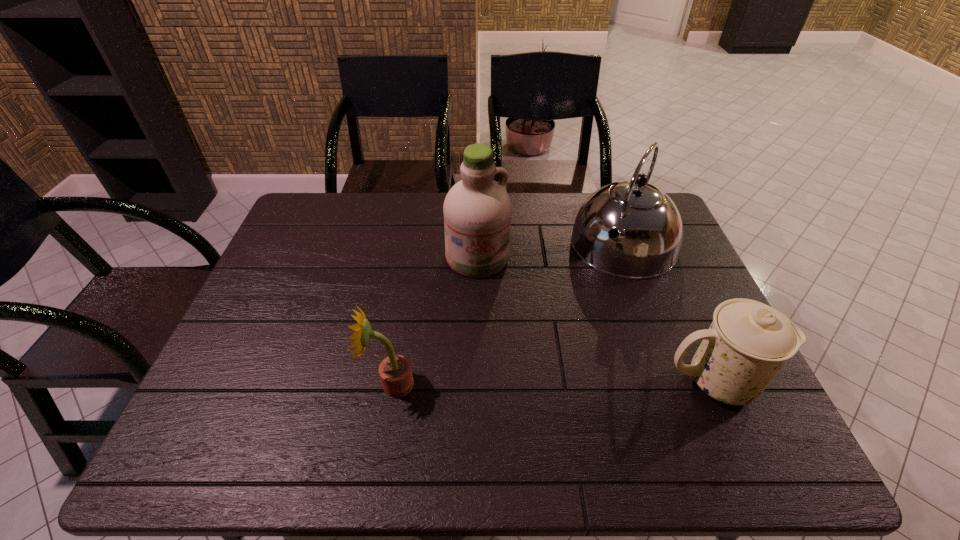
Find the location of a particular element. free location located 0.190m from the spout of the kettle is located at coordinates (579, 316).

You are a GUI agent. You are given a task and a screenshot of the screen. Output one action in this format:
    pyautogui.click(x=<x>, y=<y>)
    Task: Click on the vacant area located from the spout of the kettle
    This screenshot has width=960, height=540.
    Given the screenshot: What is the action you would take?
    pyautogui.click(x=568, y=334)

Locate an element on the screen. The image size is (960, 540). vacant area situated from the spout of the kettle is located at coordinates (574, 324).

This screenshot has width=960, height=540. Identify the location of object present at the far edge. (650, 227).

Find the location of a particular element. sunflower at the near edge is located at coordinates coord(395,371).

Find the location of `chinaware present at the near edge`. chinaware present at the near edge is located at coordinates (748, 342).

I want to click on chinaware at the right edge, so click(x=748, y=342).

At what (x,y) coordinates should I click in order to perform the action: click on kettle present at the right edge. Please return your answer as a coordinate pair (x, y). The width and height of the screenshot is (960, 540). Looking at the image, I should click on (650, 227).

Find the location of a particular element. The height and width of the screenshot is (540, 960). object that is at the far right corner is located at coordinates pyautogui.click(x=650, y=227).

This screenshot has width=960, height=540. Identify the location of object that is at the near right corner. (748, 342).